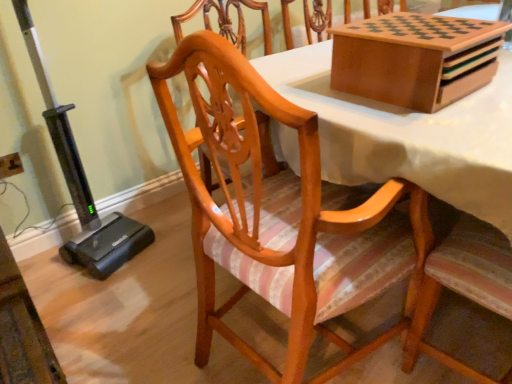
The width and height of the screenshot is (512, 384). Describe the element at coordinates (283, 215) in the screenshot. I see `matte wood chair at center` at that location.

Locate an element on the screen. This screenshot has width=512, height=384. matte wood chair at center is located at coordinates pyautogui.click(x=283, y=215).

What is the approximate height of matte wood chair at center?

matte wood chair at center is 38.85 inches tall.

What do you see at coordinates (409, 58) in the screenshot? I see `wooden game board at upper right` at bounding box center [409, 58].

Measure the distance between wooden game board at upper right and camera.

wooden game board at upper right and camera are 87.51 centimeters apart from each other.

Identify the location of wooden game board at upper right. (409, 58).

The width and height of the screenshot is (512, 384). Identify the location of matte wood chair at center. pyautogui.click(x=283, y=215).

Which object is positioned more to the left, wooden game board at upper right or matte wood chair at center?

matte wood chair at center is more to the left.

Which object is closer to the camera taking this photo, wooden game board at upper right or matte wood chair at center?

matte wood chair at center.

Does point (388, 86) appear closer or farther from the camera than point (251, 216)?

Point (388, 86) is closer to the camera than point (251, 216).

From the picture: From the image's perspective, which one is positioned lower, wooden game board at upper right or matte wood chair at center?

matte wood chair at center is shown below in the image.

From a real-world perspective, which object rests below the other?

From a 3D spatial view, matte wood chair at center is below.

Which of these two, wooden game board at upper right or matte wood chair at center, is thinner?

With smaller width is wooden game board at upper right.

Between wooden game board at upper right and matte wood chair at center, which one has more height?

matte wood chair at center is taller.

Looking at this image, does wooden game board at upper right have a larger size compared to matte wood chair at center?

No.

Do you think wooden game board at upper right is within matte wood chair at center, or outside of it?

wooden game board at upper right is outside matte wood chair at center.

Is wooden game board at upper right not near matte wood chair at center?

No, wooden game board at upper right is not far away from matte wood chair at center.

Could you tell me if wooden game board at upper right is facing matte wood chair at center?

No, wooden game board at upper right does not turn towards matte wood chair at center.

How many degrees apart are the facing directions of wooden game board at upper right and matte wood chair at center?

88.5 degrees separate the facing orientations of wooden game board at upper right and matte wood chair at center.

You are a GUI agent. You are given a task and a screenshot of the screen. Output one action in this format:
    pyautogui.click(x=<x>, y=<y>)
    Task: Click on the chair on the left of the wooden game board at upper right
    
    Given the screenshot: What is the action you would take?
    pyautogui.click(x=283, y=215)

Which object is positioned more to the left, matte wood chair at center or wooden game board at upper right?

matte wood chair at center is more to the left.

Does matte wood chair at center come in front of wooden game board at upper right?

Yes, matte wood chair at center is in front of wooden game board at upper right.

Is point (385, 231) farther from camera compared to point (355, 90)?

No, (385, 231) is in front of (355, 90).

Based on the photo, from the image's perspective, is matte wood chair at center located beneath wooden game board at upper right?

Yes.

Based on the photo, from a real-world perspective, between matte wood chair at center and wooden game board at upper right, who is vertically lower?

matte wood chair at center, from a real-world perspective.

Considering the relative sizes of matte wood chair at center and wooden game board at upper right in the image provided, is matte wood chair at center wider than wooden game board at upper right?

Indeed, matte wood chair at center has a greater width compared to wooden game board at upper right.

Does matte wood chair at center have a lesser height compared to wooden game board at upper right?

In fact, matte wood chair at center may be taller than wooden game board at upper right.

Who is smaller, matte wood chair at center or wooden game board at upper right?

With smaller size is wooden game board at upper right.

Is matte wood chair at center outside of wooden game board at upper right?

Yes, matte wood chair at center is located beyond the bounds of wooden game board at upper right.

Would you say matte wood chair at center is a long distance from wooden game board at upper right?

No.

Could you tell me if matte wood chair at center is facing wooden game board at upper right?

Yes, matte wood chair at center is turned towards wooden game board at upper right.

How many degrees apart are the facing directions of matte wood chair at center and wooden game board at upper right?

They differ by 88.5 degrees in their facing directions.

The image size is (512, 384). I want to click on chair on the left of wooden game board at upper right, so click(x=283, y=215).

At what (x,y) coordinates should I click in order to perform the action: click on chair below the wooden game board at upper right (from the image's perspective). Please return your answer as a coordinate pair (x, y). Looking at the image, I should click on (283, 215).

In order to click on cardboard box on the right of matte wood chair at center in this screenshot , I will do `click(409, 58)`.